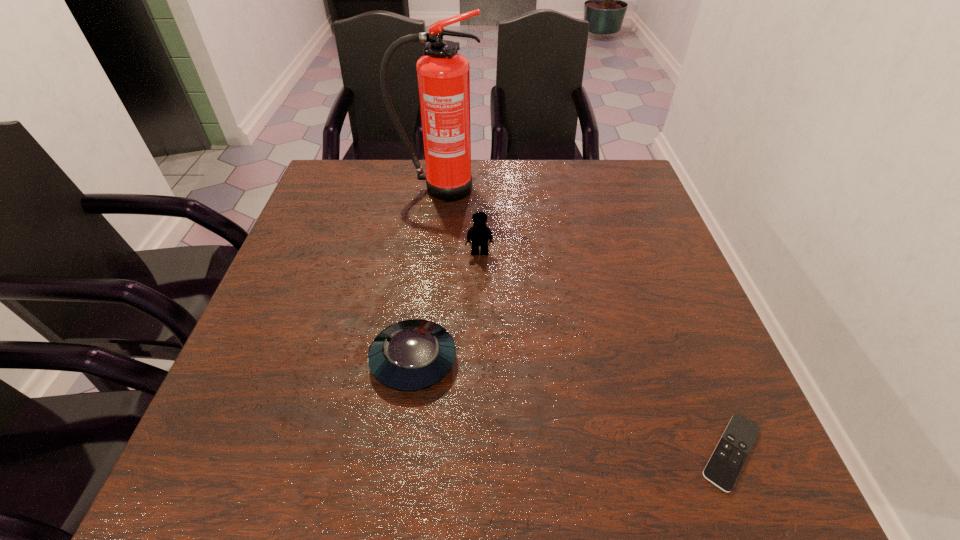
Locate an element on the screen. The image size is (960, 540). free space between the saucer and the rightmost object is located at coordinates (572, 406).

You are a GUI agent. You are given a task and a screenshot of the screen. Output one action in this format:
    pyautogui.click(x=<x>, y=<y>)
    Task: Click on the vacant space that is in between the Lego and the third farthest object
    
    Given the screenshot: What is the action you would take?
    pyautogui.click(x=446, y=306)

The image size is (960, 540). I want to click on object that is the second nearest to the rightmost object, so click(479, 234).

At what (x,y) coordinates should I click in order to perform the action: click on the closest object to the second shortest object. Please return your answer as a coordinate pair (x, y). The width and height of the screenshot is (960, 540). Looking at the image, I should click on (479, 234).

Where is `vacant space that satisfies the following two spatial constraints: 1. at the nozzle of the rightmost object; 2. on the right side of the fire extinguisher`? This screenshot has width=960, height=540. vacant space that satisfies the following two spatial constraints: 1. at the nozzle of the rightmost object; 2. on the right side of the fire extinguisher is located at coordinates coord(407,452).

Where is `free space that satisfies the following two spatial constraints: 1. on the front-facing side of the remote control; 2. on the right side of the second farthest object`? free space that satisfies the following two spatial constraints: 1. on the front-facing side of the remote control; 2. on the right side of the second farthest object is located at coordinates (479, 452).

Identify the location of vacant area in the image that satisfies the following two spatial constraints: 1. on the front side of the rightmost object; 2. on the left side of the saucer. (402, 452).